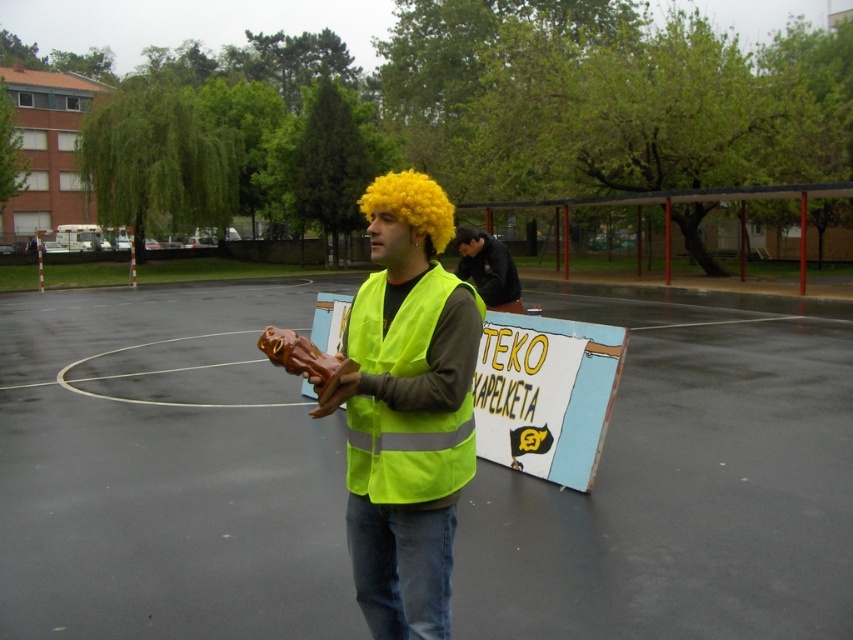
Question: Which of the following is the closest to the observer?

Choices:
 (A) rubberized brown statue at center
 (B) fluffy yellow wig at center
 (C) dark brown leather jacket at center

Answer: (B)

Question: Is dark brown leather jacket at center smaller than golden synthetic wig at center?

Choices:
 (A) no
 (B) yes

Answer: (B)

Question: Is the position of neon yellow reflective safety vest at center more distant than that of fluffy yellow wig at center?

Choices:
 (A) yes
 (B) no

Answer: (B)

Question: Based on their relative distances, which object is nearer to the fluffy yellow wig at center?

Choices:
 (A) rubber-like brown hand at center
 (B) rubberized brown statue at center

Answer: (B)

Question: Which point is closer to the camera taking this photo?

Choices:
 (A) (473, 289)
 (B) (100, 435)
 (C) (460, 248)

Answer: (A)

Question: Is neon yellow reflective safety vest at center further to camera compared to golden synthetic wig at center?

Choices:
 (A) no
 (B) yes

Answer: (A)